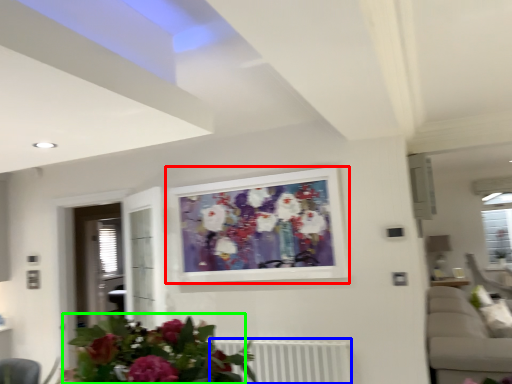
Question: Which object is positioned farthest from picture frame (highlighted by a red box)? Select from radiator (highlighted by a blue box) and floral arrangement (highlighted by a green box).

Choices:
 (A) radiator
 (B) floral arrangement

Answer: (B)